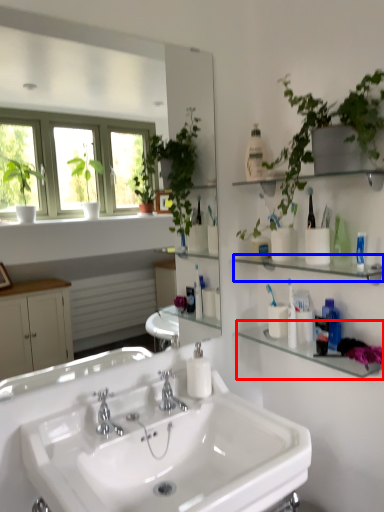
Question: Which object appears closest to the camera in this image, shelf (highlighted by a red box) or shelf (highlighted by a blue box)?

Choices:
 (A) shelf
 (B) shelf

Answer: (B)